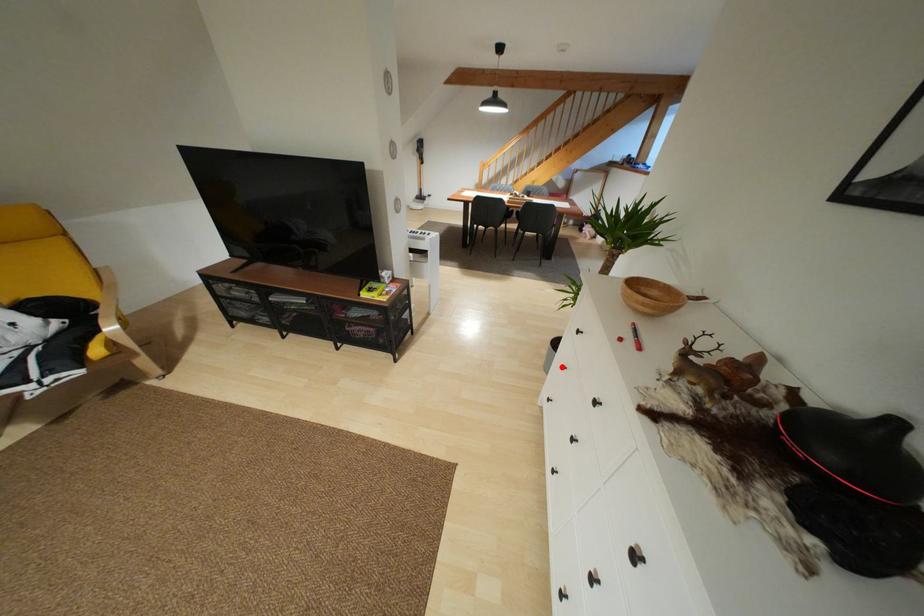
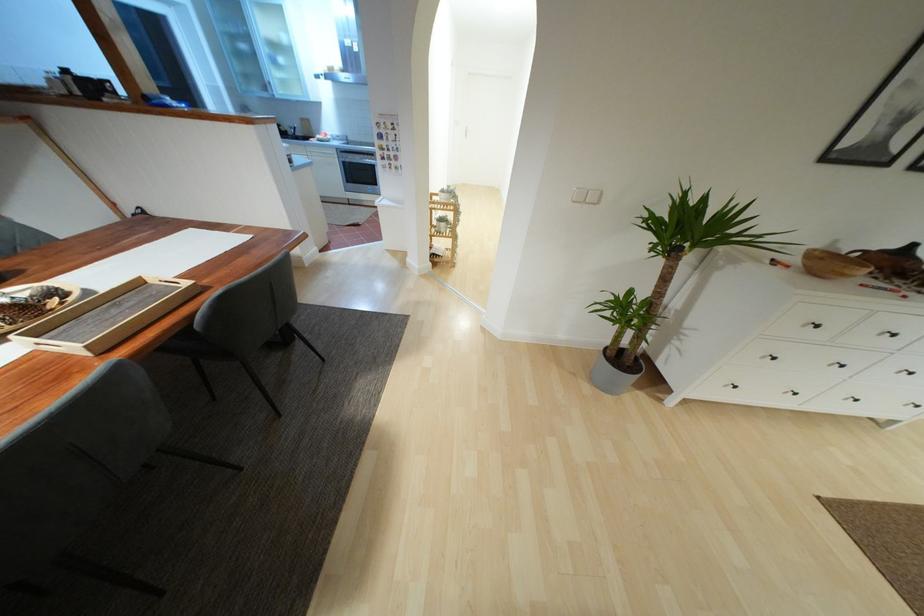
The point at the highlighted location is marked in the first image. Where is the corresponding point in the second image?

(773, 358)